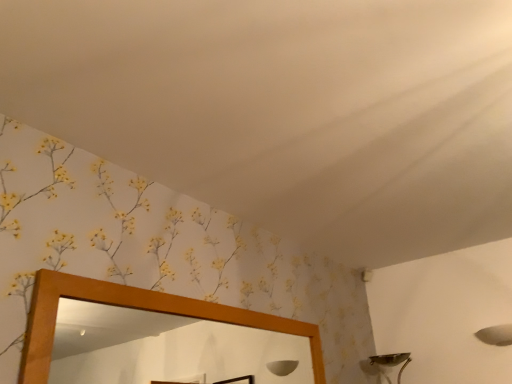
What do you see at coordinates (167, 348) in the screenshot?
I see `wooden mirror at lower center` at bounding box center [167, 348].

Locate an element on the screen. Image resolution: width=512 pixels, height=384 pixels. wooden mirror at lower center is located at coordinates (167, 348).

The height and width of the screenshot is (384, 512). Find the location of `wooden mirror at lower center`. wooden mirror at lower center is located at coordinates (167, 348).